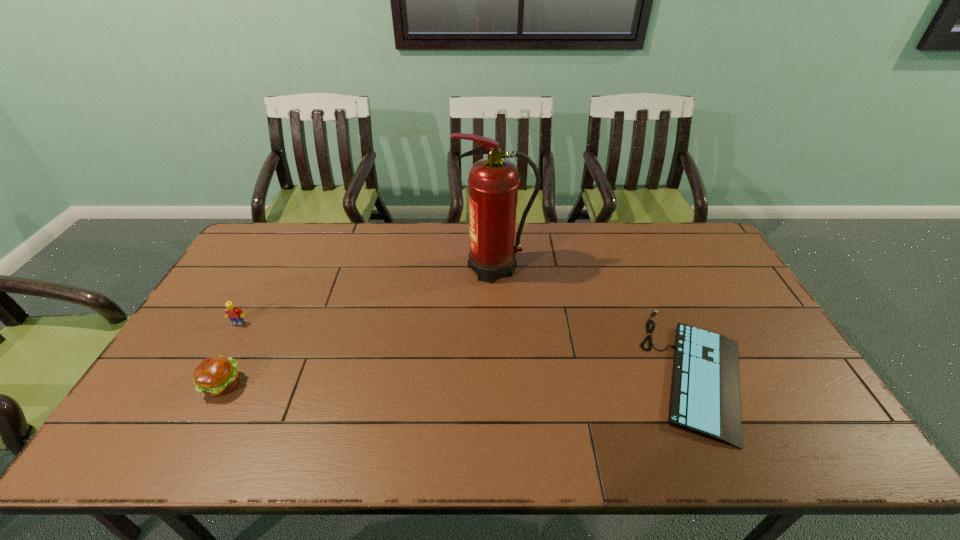
In the image, there is a desktop. What are the coordinates of `vacant space at the far left corner` in the screenshot? It's located at (244, 251).

You are a GUI agent. You are given a task and a screenshot of the screen. Output one action in this format:
    pyautogui.click(x=<x>, y=<y>)
    Task: Click on the free space at the far right corner of the desktop
    This screenshot has height=540, width=960.
    Given the screenshot: What is the action you would take?
    pyautogui.click(x=677, y=238)

This screenshot has width=960, height=540. Find the location of `vacant space that is in between the hamburger and the computer keyboard`. vacant space that is in between the hamburger and the computer keyboard is located at coordinates (461, 377).

Image resolution: width=960 pixels, height=540 pixels. I want to click on free spot between the Lego and the rightmost object, so click(469, 347).

This screenshot has height=540, width=960. Find the location of `free space between the farthest object and the hamburger`. free space between the farthest object and the hamburger is located at coordinates (358, 326).

This screenshot has width=960, height=540. I want to click on vacant area between the hamburger and the shortest object, so click(x=461, y=377).

Image resolution: width=960 pixels, height=540 pixels. Identify the location of vacant space that is in between the hamburger and the Lego. (230, 354).

Find the location of a particular element. free point between the hamburger and the Lego is located at coordinates (230, 354).

Locate an element on the screen. The width and height of the screenshot is (960, 540). unoccupied position between the computer keyboard and the Lego is located at coordinates (469, 347).

I want to click on free spot between the hamburger and the Lego, so click(230, 354).